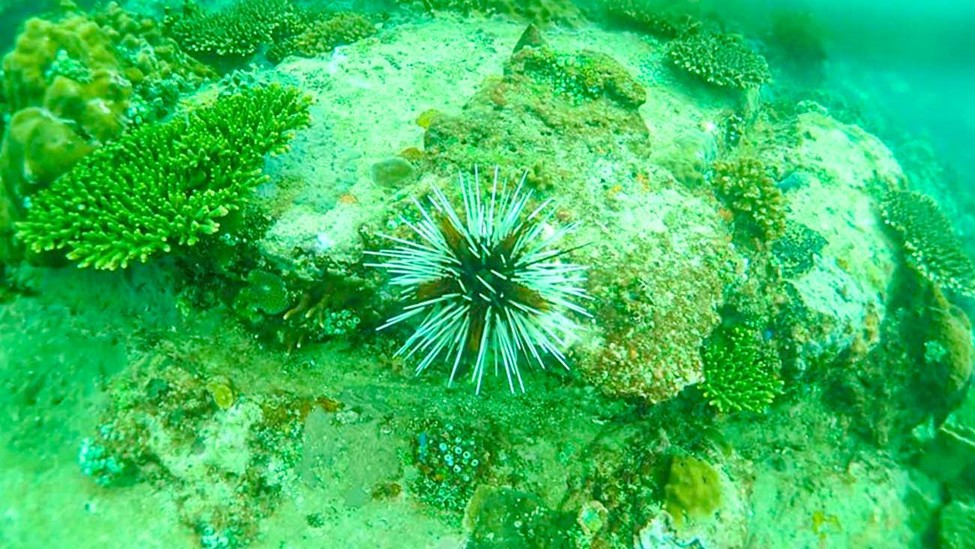
Locate an element on the screen. The height and width of the screenshot is (549, 975). plant on the right side is located at coordinates (916, 242).